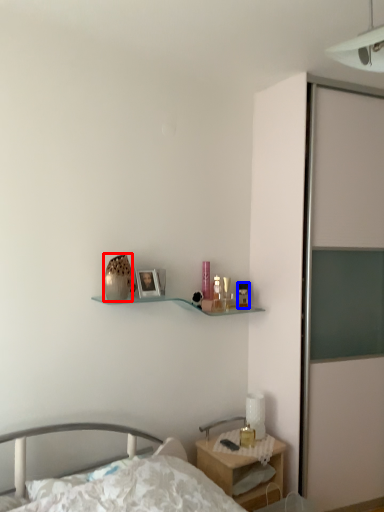
Question: Among these objects, which one is nearest to the camera, vase (highlighted by a red box) or toiletry (highlighted by a blue box)?

Choices:
 (A) vase
 (B) toiletry

Answer: (A)